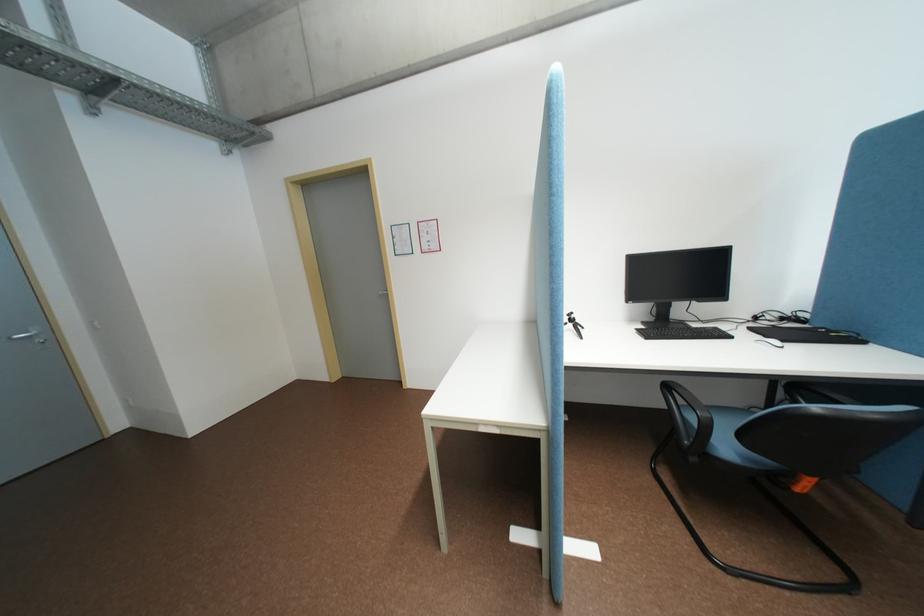
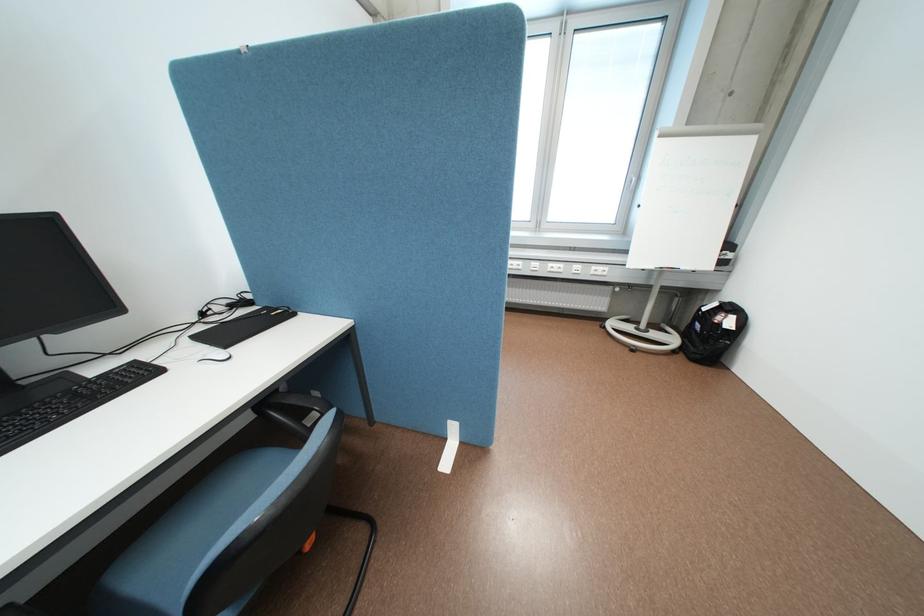
Locate, in the second image, the point that corresponds to point (726, 328) in the first image.

(146, 362)